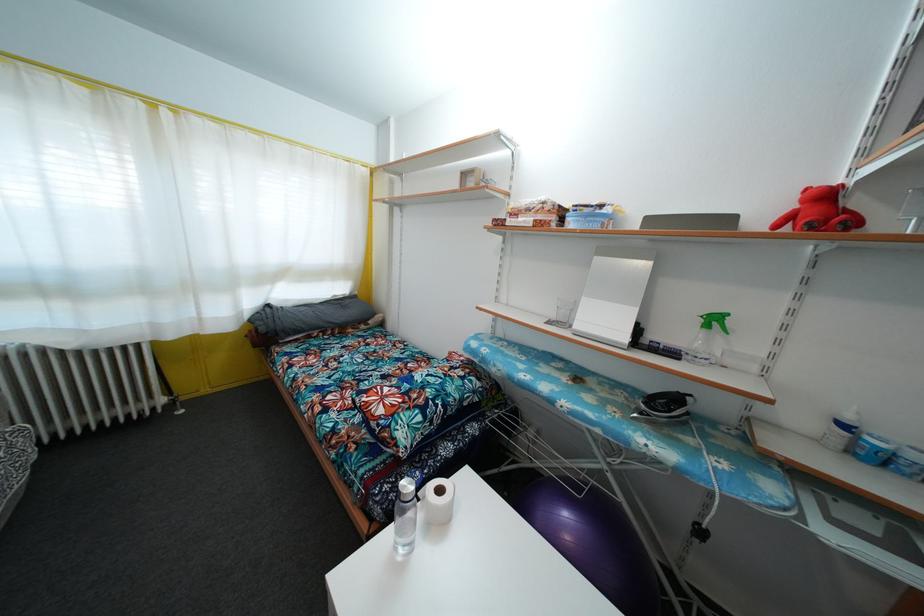
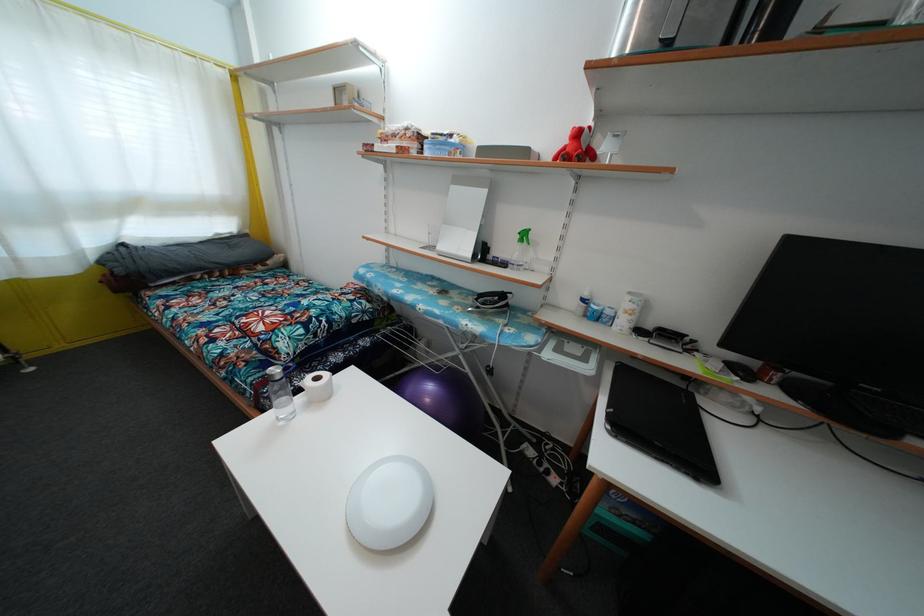
Find the pixel in the second image that matches (x=444, y=498) in the first image.

(321, 386)